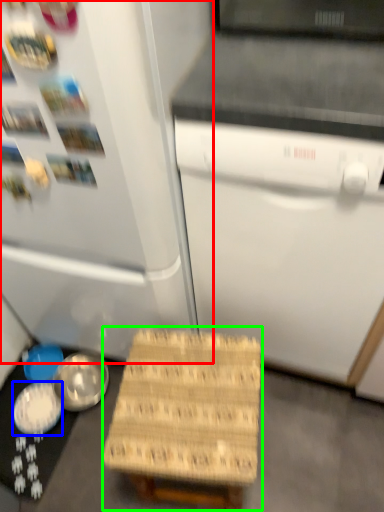
Question: Which object is positioned farthest from refrigerator (highlighted by a red box)? Select from bowl (highlighted by a blue box) and step stool (highlighted by a green box).

Choices:
 (A) bowl
 (B) step stool

Answer: (A)